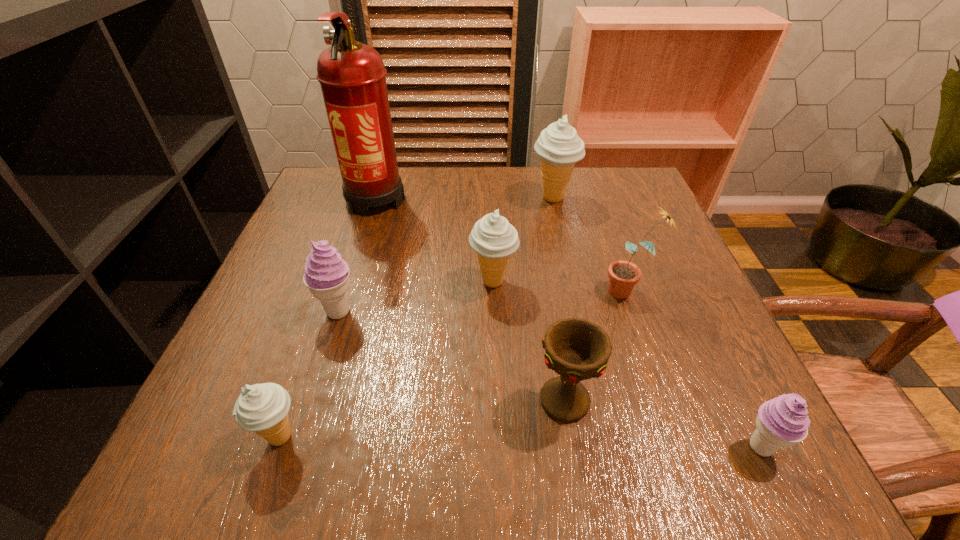
The height and width of the screenshot is (540, 960). I want to click on red fire extinguisher, so coord(352,76).

At what (x,y) coordinates should I click in order to perform the action: click on the tallest object. Please return your answer as a coordinate pair (x, y). This screenshot has height=540, width=960. Looking at the image, I should click on (352, 76).

I want to click on the tallest icecream, so click(x=559, y=147).

Locate an element on the screen. The height and width of the screenshot is (540, 960). the farthest beige icecream is located at coordinates (559, 147).

Image resolution: width=960 pixels, height=540 pixels. Find the location of `sunflower`. sunflower is located at coordinates (623, 275).

This screenshot has height=540, width=960. Find the location of `the third icecream from left to right`. the third icecream from left to right is located at coordinates (494, 239).

Where is `the second farthest beige icecream`? The width and height of the screenshot is (960, 540). the second farthest beige icecream is located at coordinates (494, 239).

You are a GUI agent. You are given a task and a screenshot of the screen. Output one action in this format:
    pyautogui.click(x=<x>, y=<y>)
    Task: Click on the farther purple icecream
    The width and height of the screenshot is (960, 540).
    Given the screenshot: What is the action you would take?
    pyautogui.click(x=326, y=275)

At what (x,y) coordinates should I click in order to perform the action: click on the left purple icecream. Please return your answer as a coordinate pair (x, y). Looking at the image, I should click on (326, 275).

This screenshot has height=540, width=960. Find the location of `red chalice`. red chalice is located at coordinates (577, 349).